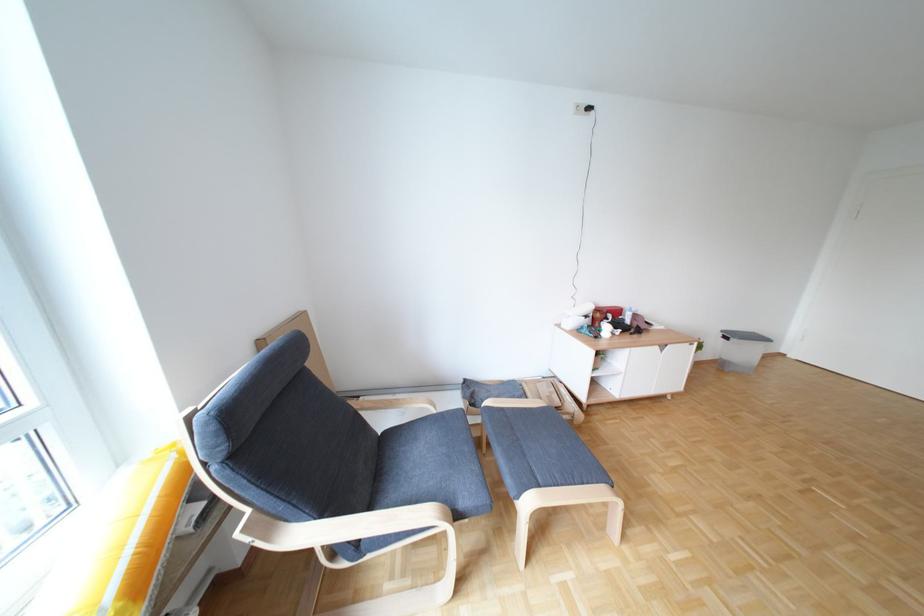
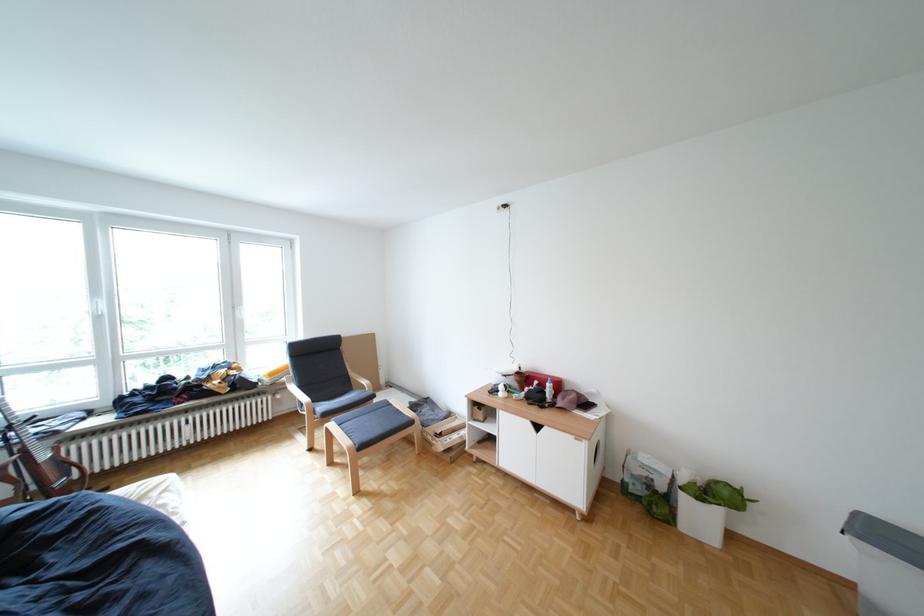
Question: I am providing you with two images of the same scene from different viewpoints. After the viewpoint changes to image2, which objects are now occluded?

Choices:
 (A) white storage bin
 (B) cardboard box
 (C) green plastic shelf
 (D) chair armrest

Answer: (D)